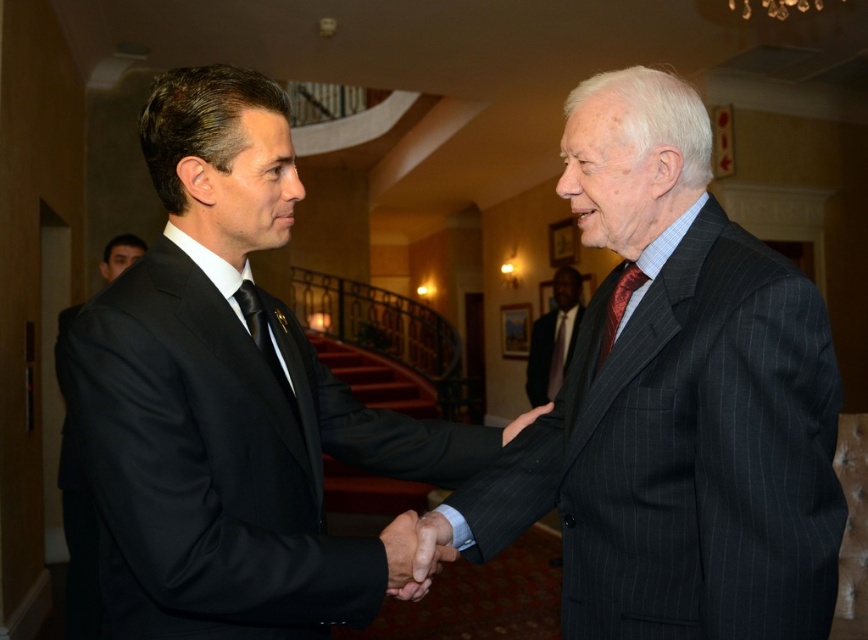
Question: Which point is closer to the camera taking this photo?

Choices:
 (A) (549, 410)
 (B) (422, 557)

Answer: (B)

Question: Is shiny red tie at center to the right of dark red silk tie at center from the viewer's perspective?

Choices:
 (A) no
 (B) yes

Answer: (A)

Question: Does pinstriped suit at center appear on the left side of dark red silk tie at center?

Choices:
 (A) yes
 (B) no

Answer: (A)

Question: Which point is farther from the camera taking this photo?

Choices:
 (A) pyautogui.click(x=247, y=292)
 (B) pyautogui.click(x=722, y=420)

Answer: (A)

Question: Which object appears farthest from the camera in this image?

Choices:
 (A) pinstriped suit at center
 (B) shiny red tie at center
 (C) smooth leather hand at center

Answer: (B)

Question: Is pinstriped suit at center smaller than shiny red tie at center?

Choices:
 (A) no
 (B) yes

Answer: (A)